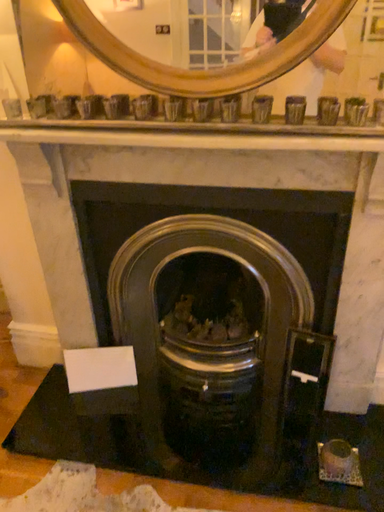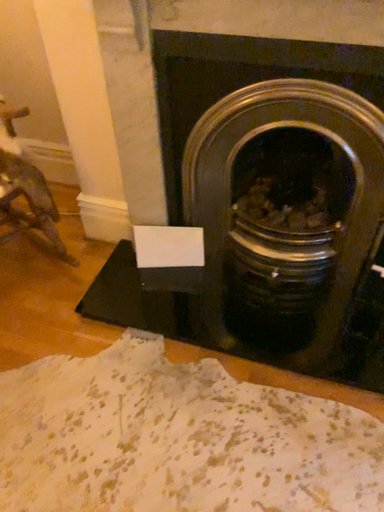
Question: How did the camera likely rotate when shooting the video?

Choices:
 (A) rotated upward
 (B) rotated downward

Answer: (B)